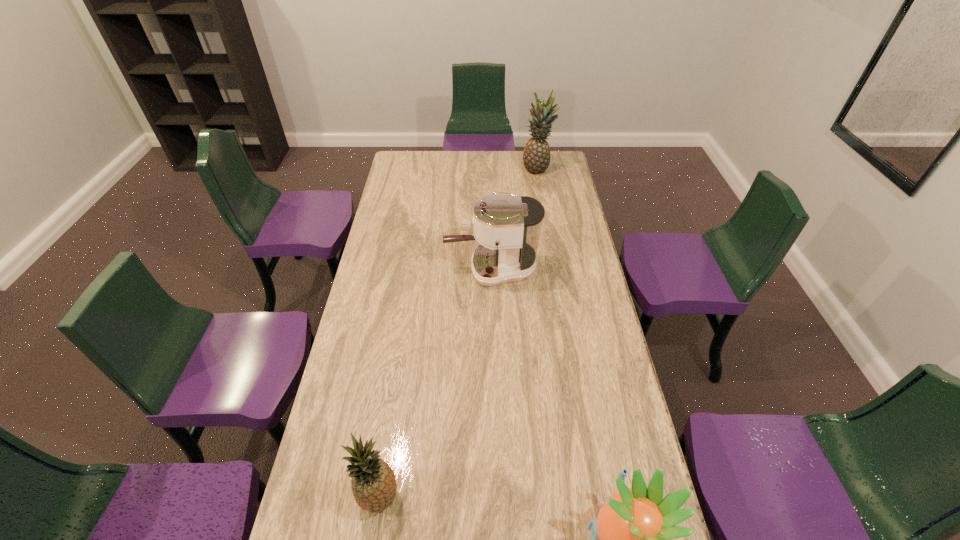
Where is `the tallest pineapple`? the tallest pineapple is located at coordinates (536, 156).

This screenshot has height=540, width=960. What are the coordinates of `the farthest object` in the screenshot? It's located at (536, 156).

Where is `coffee maker`? coffee maker is located at coordinates (507, 227).

Where is `the leftmost object`? This screenshot has width=960, height=540. the leftmost object is located at coordinates (374, 487).

At what (x,y) coordinates should I click in order to perform the action: click on free space located 0.130m on the front of the tallest object. Please return your answer as a coordinate pair (x, y). This screenshot has width=960, height=540. Looking at the image, I should click on (540, 192).

Where is `vacant space situated 0.250m on the front-facing side of the coffee maker`? Image resolution: width=960 pixels, height=540 pixels. vacant space situated 0.250m on the front-facing side of the coffee maker is located at coordinates (382, 269).

This screenshot has height=540, width=960. What are the coordinates of `vacant region located 0.090m on the front-facing side of the coffee maker` in the screenshot? It's located at (x=422, y=269).

The width and height of the screenshot is (960, 540). I want to click on vacant space located 0.300m on the front-facing side of the coffee maker, so click(370, 269).

Where is `vacant region located on the back of the leftmost pineapple`? This screenshot has width=960, height=540. vacant region located on the back of the leftmost pineapple is located at coordinates (396, 381).

Locate an element on the screen. The width and height of the screenshot is (960, 540). object positioned at the far edge is located at coordinates (536, 156).